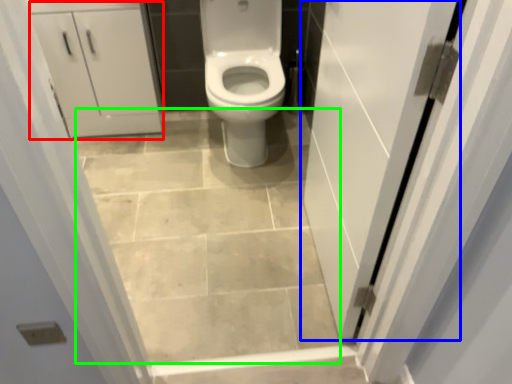
Question: Estimate the real-world distances between objects in this image. Which object is closer to cabinetry (highlighted by a red box), door (highlighted by a blue box) or ceramic tile (highlighted by a green box)?

Choices:
 (A) door
 (B) ceramic tile

Answer: (B)